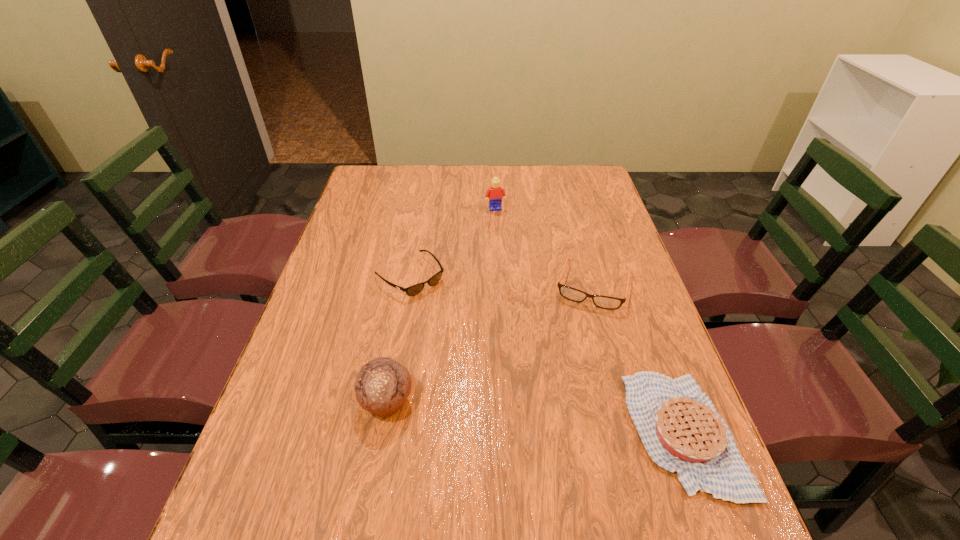
Locate an element on the screen. spectacles that is at the right edge is located at coordinates (605, 302).

This screenshot has width=960, height=540. I want to click on object present at the near right corner, so click(679, 426).

The height and width of the screenshot is (540, 960). Find the location of `vacant area at the far edge`. vacant area at the far edge is located at coordinates (441, 173).

This screenshot has height=540, width=960. In the image, there is a desktop. In order to click on vacant area at the near edge in this screenshot , I will do `click(568, 496)`.

Locate an element on the screen. vacant space at the left edge is located at coordinates (365, 241).

Locate an element on the screen. vacant space at the right edge of the desktop is located at coordinates (627, 324).

At what (x,y) coordinates should I click in order to perform the action: click on unoccupied area between the muffin and the pie. Please return your answer as a coordinate pair (x, y). Looking at the image, I should click on (535, 417).

At what (x,y) coordinates should I click in order to perform the action: click on unoccupied position between the muffin and the spectacles. Please return your answer as a coordinate pair (x, y). This screenshot has width=960, height=540. Looking at the image, I should click on (491, 343).

Find the location of `free spot between the farthest object and the spectacles`. free spot between the farthest object and the spectacles is located at coordinates (544, 247).

I want to click on free space between the pie and the sunglasses, so click(x=546, y=354).